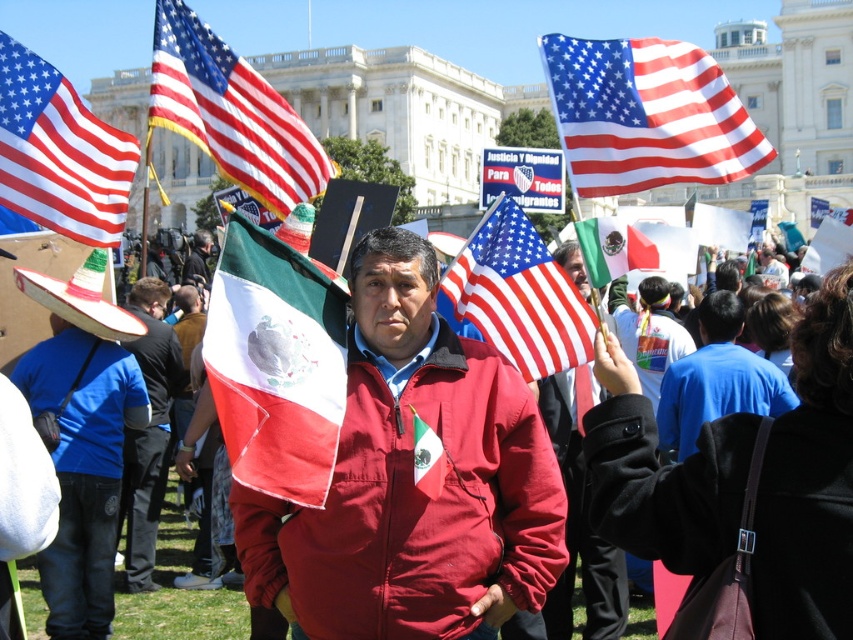
Question: Can you confirm if red/white/blue fabric american flag at upper left is positioned below red and green fabric flag at center?

Choices:
 (A) no
 (B) yes

Answer: (A)

Question: Which object is the farthest from the red/white/blue fabric american flag at upper left?

Choices:
 (A) blue cotton shirt at center
 (B) red and green fabric flag at center
 (C) red matte jacket at center
 (D) red and white fabric flag at center

Answer: (A)

Question: Which point is farther to the camera?

Choices:
 (A) matte red jacket at center
 (B) blue cotton shirt at center
 (C) red/white/blue fabric american flag at upper left

Answer: (B)

Question: Does matte red jacket at center lie behind american flag at center?

Choices:
 (A) no
 (B) yes

Answer: (A)

Question: Which point appears closest to the camera in this image?

Choices:
 (A) (56, 216)
 (B) (762, 404)

Answer: (A)

Question: Does red/white/blue fabric american flag at upper left appear over red and green fabric flag at center?

Choices:
 (A) no
 (B) yes

Answer: (B)